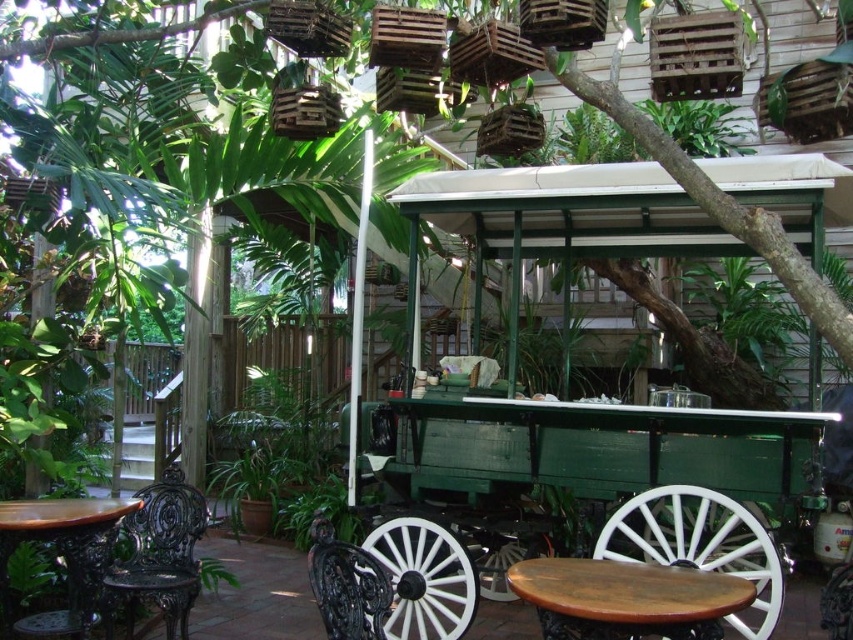
Question: Which object is positioned farthest from the black wrought iron chair at lower center?

Choices:
 (A) green wooden wagon at center
 (B) black wrought iron chair at lower left
 (C) wooden table at center
 (D) wooden table at lower left

Answer: (A)

Question: Which point is farther from the camera taking this photo?

Choices:
 (A) (527, 588)
 (B) (48, 529)

Answer: (B)

Question: Does wooden table at lower left have a larger size compared to black wrought iron chair at lower center?

Choices:
 (A) no
 (B) yes

Answer: (B)

Question: Observing the image, what is the correct spatial positioning of wooden table at center in reference to black wrought iron chair at lower center?

Choices:
 (A) below
 (B) above

Answer: (B)

Question: Among these points, which one is farthest from the camera?

Choices:
 (A) (770, 449)
 (B) (672, 614)
 (C) (354, 563)
 (D) (126, 499)

Answer: (D)

Question: Does green wooden wagon at center appear on the right side of wooden table at center?

Choices:
 (A) no
 (B) yes

Answer: (B)